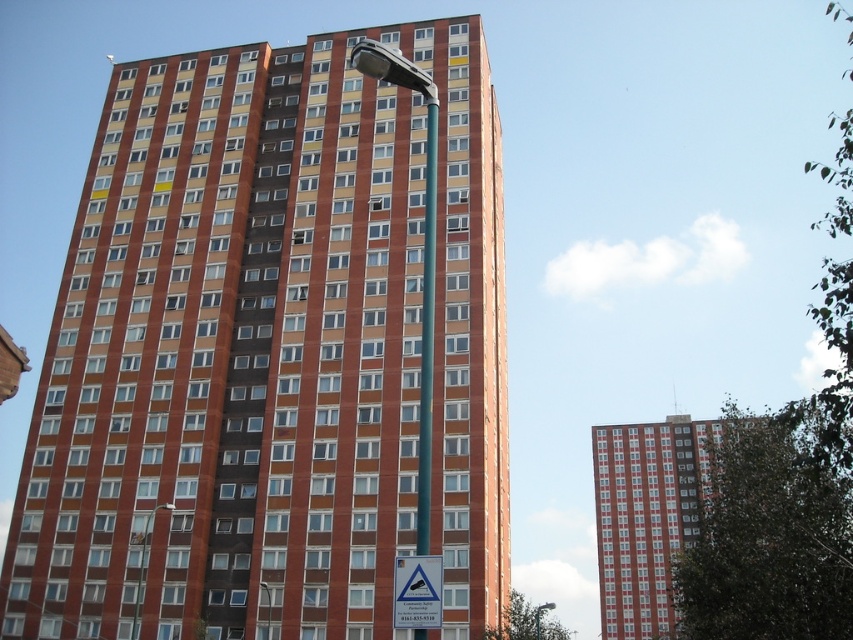
Does brick textured building at center appear on the right side of green metallic pole at center?

Indeed, brick textured building at center is positioned on the right side of green metallic pole at center.

Does brick textured building at center lie in front of green metallic pole at center?

That is False.

Locate an element on the screen. The height and width of the screenshot is (640, 853). brick textured building at center is located at coordinates (653, 513).

Locate an element on the screen. brick textured building at center is located at coordinates (653, 513).

Can you confirm if green metallic pole at center is thinner than white plastic triangle at lower center?

Indeed, green metallic pole at center has a lesser width compared to white plastic triangle at lower center.

Does green metallic pole at center have a smaller size compared to white plastic triangle at lower center?

No, green metallic pole at center is not smaller than white plastic triangle at lower center.

Who is more distant from viewer, (421, 410) or (418, 570)?

The point (421, 410) is more distant.

This screenshot has width=853, height=640. I want to click on green metallic pole at center, so click(427, 330).

From the picture: Is the position of brick building at center less distant than that of brick textured building at center?

No, it is behind brick textured building at center.

At what (x,y) coordinates should I click in order to perform the action: click on brick building at center. Please return your answer as a coordinate pair (x, y). Looking at the image, I should click on (270, 353).

Locate an element on the screen. This screenshot has height=640, width=853. brick building at center is located at coordinates (270, 353).